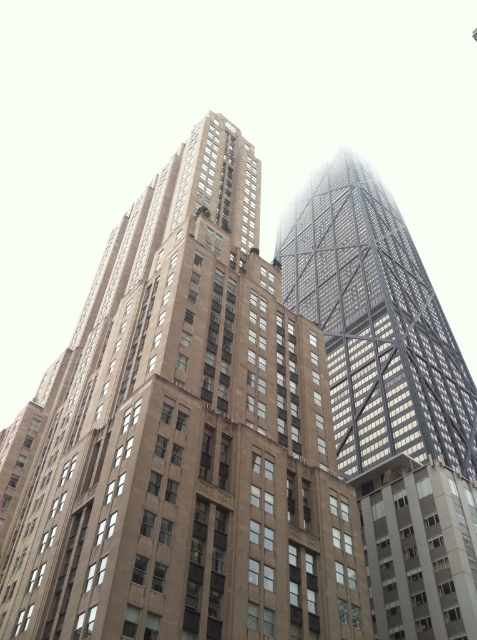
Question: Is brown stone building at center to the right of metallic glass tower at upper right from the viewer's perspective?

Choices:
 (A) no
 (B) yes

Answer: (A)

Question: Is brown stone building at center to the left of metallic glass tower at upper right from the viewer's perspective?

Choices:
 (A) yes
 (B) no

Answer: (A)

Question: Is brown stone building at center closer to the viewer compared to metallic glass tower at upper right?

Choices:
 (A) yes
 (B) no

Answer: (A)